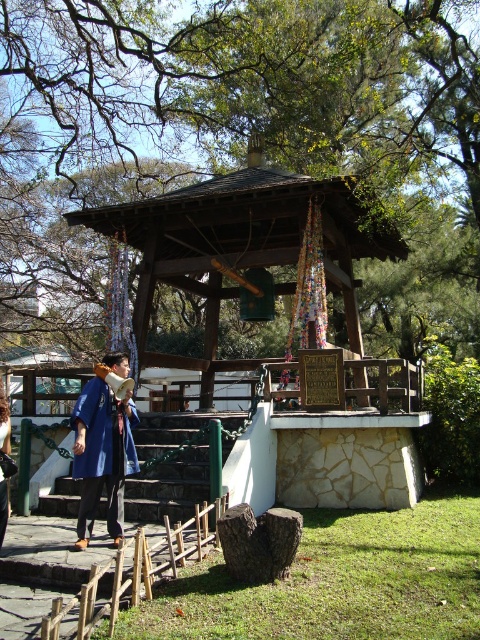
Question: Can you confirm if green leafy tree at upper center is positioned above wooden gazebo at center?

Choices:
 (A) yes
 (B) no

Answer: (A)

Question: Is green leafy tree at upper center closer to the viewer compared to blue silk kimono at lower left?

Choices:
 (A) no
 (B) yes

Answer: (A)

Question: Is wooden gazebo at center wider than green stone stairs at center?

Choices:
 (A) yes
 (B) no

Answer: (A)

Question: Which point is farther to the camera?

Choices:
 (A) (414, 465)
 (B) (9, 509)

Answer: (A)

Question: Which of the following is the farthest from the observer?

Choices:
 (A) (82, 513)
 (B) (188, 516)
 (C) (164, 70)

Answer: (C)

Question: Among these objects, which one is farthest from the camera?

Choices:
 (A) green leafy tree at upper center
 (B) green stone stairs at center

Answer: (A)